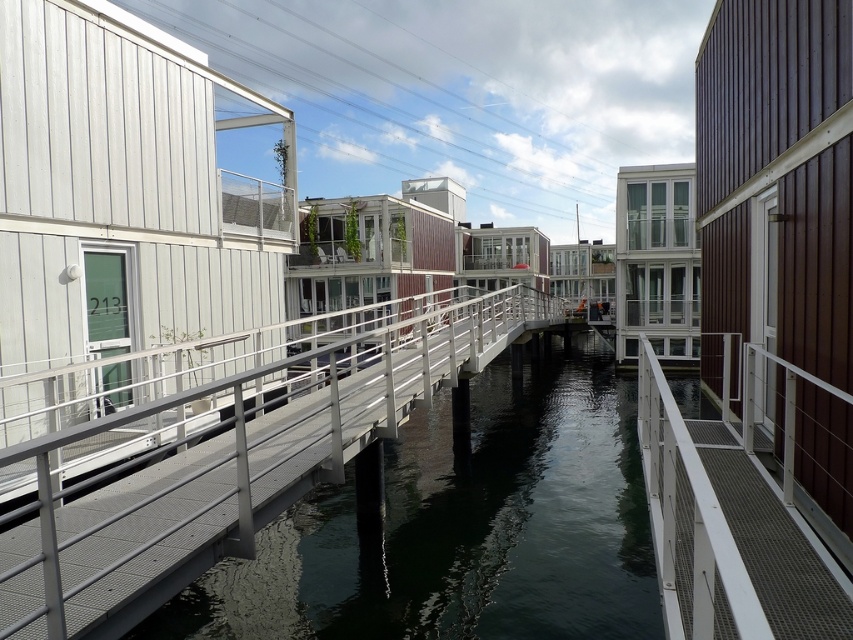
You are standing at the edge of one of the floating houses and want to reach the walkway. The point you need to step onto is located at point (608, 618). Given that your maximum comfortable stepping distance is 18 feet, will you be able to reach it?

The distance between your current position and point (608, 618) is 19.81 feet, which exceeds your maximum comfortable stepping distance of 18 feet. Therefore, you will not be able to reach it comfortably.

You are a visitor standing on the metal mesh dock at center and want to see the water clearly. Is the transparent glass water at center located to your right or left side?

The transparent glass water at center is positioned on the right side of metal mesh dock at center, so it is to your right side.